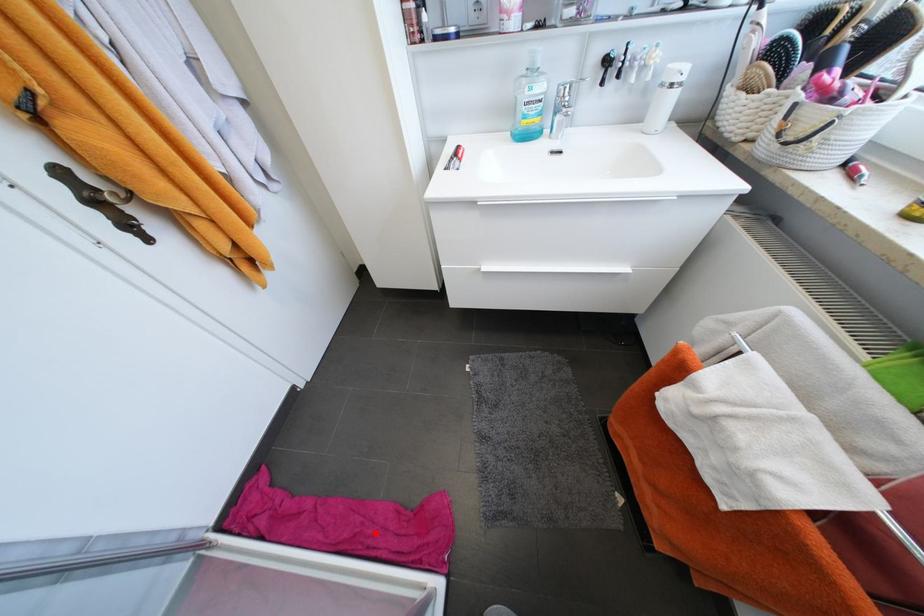
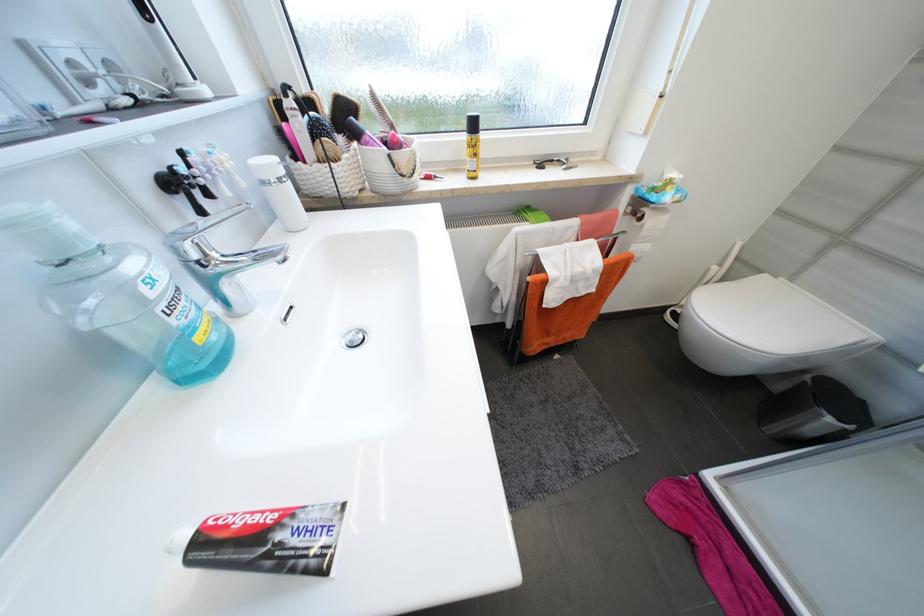
Question: I am providing you with two images of the same scene from different viewpoints. Image1 has a red point marked. In image2, the corresponding 3D location appears at what relative position? Reply with the corresponding letter.

Choices:
 (A) Closer
 (B) Farther

Answer: (B)